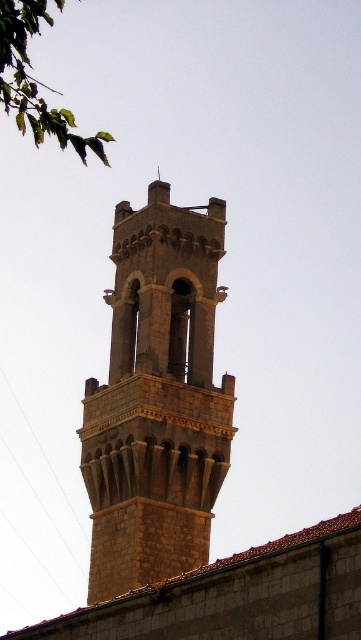
You are standing at the base of the bell tower and notice two points marked on the tower. The first point is at coordinates point (193, 531) and the second point is at point (45, 122). Which point is closer to the top of the tower?

Point (193, 531) is behind point (45, 122), so it is closer to the top of the tower.

You are standing at the coordinates point 0.5, 0.5. You want to move towards the stone tower at center. Which direction should you move in?

The stone tower at center is located at point (x=157, y=400). Since you are at point (x=180, y=320), you should move northeast to reach it.